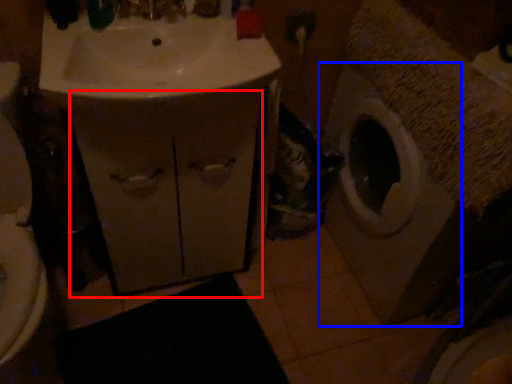
Question: Which object is further to the camera taking this photo, drawer (highlighted by a red box) or washing machine (highlighted by a blue box)?

Choices:
 (A) drawer
 (B) washing machine

Answer: (A)